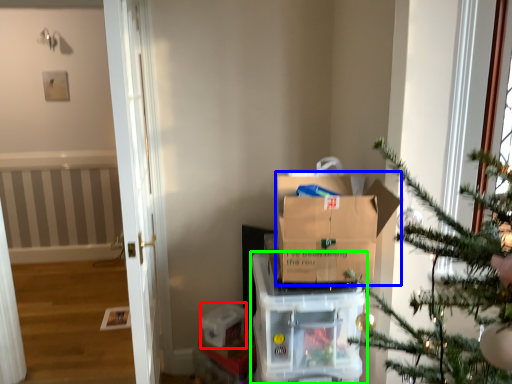
Question: Which object is positioned farthest from storage box (highlighted by a red box)? Select from cardboard box (highlighted by a blue box) and appliance (highlighted by a green box).

Choices:
 (A) cardboard box
 (B) appliance

Answer: (A)